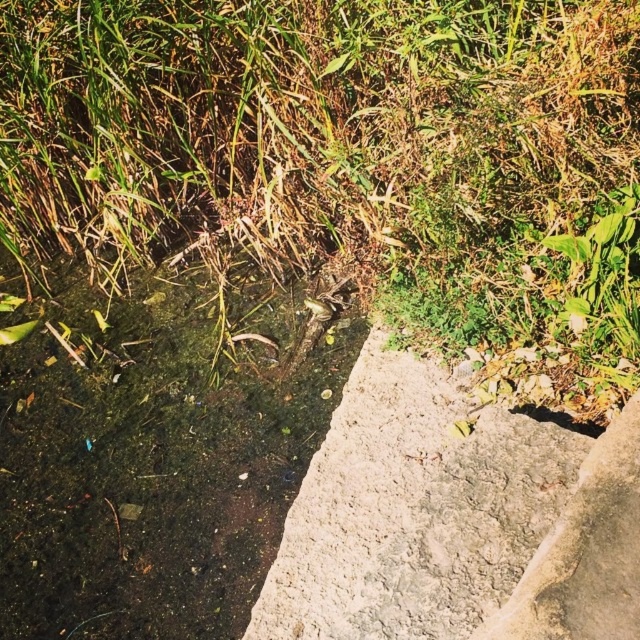
You are a gardener who wants to mow the green grass at center and clean the green algae water at center. Which task should you do first based on their heights?

The green grass at center is much taller than the green algae water at center, so you should mow the green grass at center first before cleaning the algae water.

Where is the green grass at center located in the image?

The green grass at center is located at point coordinates of approximately 0.203 on the x axis and 0.484 on the y axis.

You are standing at the edge of the scene and want to cross to the other side. You see the green algae water at center and the gray concrete wall at center. Which one is higher and therefore might block your path?

The green algae water at center has a greater height compared to the gray concrete wall at center, so it might block your path.